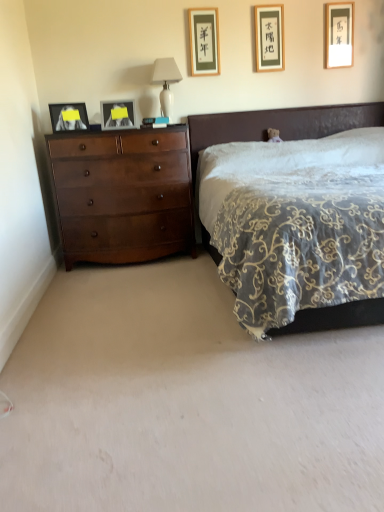
Locate an element on the screen. The width and height of the screenshot is (384, 512). matte wooden picture frame at upper center, placed as the fourth picture frame when sorted from left to right is located at coordinates (269, 38).

Image resolution: width=384 pixels, height=512 pixels. Describe the element at coordinates (68, 117) in the screenshot. I see `matte black picture frame at left, which appears as the 1th picture frame when viewed from the left` at that location.

What do you see at coordinates (279, 124) in the screenshot? The height and width of the screenshot is (512, 384). I see `velvet dark brown bed at center` at bounding box center [279, 124].

What are the coordinates of `black paper picture frame at upper center, the 3th picture frame viewed from the right` in the screenshot? It's located at (204, 41).

This screenshot has height=512, width=384. What do you see at coordinates (166, 83) in the screenshot?
I see `white glossy table lamp at upper center` at bounding box center [166, 83].

Where is `shiny brown dresser at left`? This screenshot has height=512, width=384. shiny brown dresser at left is located at coordinates (122, 195).

Between velvet dark brown bed at center and matte black picture frame at left, the 5th picture frame in the right-to-left sequence, which one appears on the right side from the viewer's perspective?

Positioned to the right is velvet dark brown bed at center.

In the scene shown: Considering the relative sizes of velvet dark brown bed at center and matte black picture frame at left, which appears as the 1th picture frame when viewed from the left, in the image provided, is velvet dark brown bed at center bigger than matte black picture frame at left, which appears as the 1th picture frame when viewed from the left,?

Correct, velvet dark brown bed at center is larger in size than matte black picture frame at left, which appears as the 1th picture frame when viewed from the left.

Is velvet dark brown bed at center wider than matte black picture frame at left, the 5th picture frame in the right-to-left sequence?

Indeed, velvet dark brown bed at center has a greater width compared to matte black picture frame at left, the 5th picture frame in the right-to-left sequence.

Locate an element on the screen. bed below the matte black picture frame at left, the 5th picture frame in the right-to-left sequence (from a real-world perspective) is located at coordinates (279, 124).

Does velvet dark brown bed at center turn towards white glossy table lamp at upper center?

No, velvet dark brown bed at center is not turned towards white glossy table lamp at upper center.

Between velvet dark brown bed at center and white glossy table lamp at upper center, which one has smaller width?

white glossy table lamp at upper center is thinner.

Is white glossy table lamp at upper center surrounded by velvet dark brown bed at center?

Definitely not — white glossy table lamp at upper center is not inside velvet dark brown bed at center.

Can you tell me how much matte wooden picture frame at upper center, placed as the 2th picture frame when sorted from right to left, and matte black picture frame at upper center, which is the second picture frame from left to right, differ in facing direction?

The angle between the facing direction of matte wooden picture frame at upper center, placed as the 2th picture frame when sorted from right to left, and the facing direction of matte black picture frame at upper center, which is the second picture frame from left to right, is 3.73 degrees.

Can you see matte wooden picture frame at upper center, placed as the 2th picture frame when sorted from right to left, touching matte black picture frame at upper center, the 4th picture frame in the right-to-left sequence?

No, matte wooden picture frame at upper center, placed as the 2th picture frame when sorted from right to left, is not making contact with matte black picture frame at upper center, the 4th picture frame in the right-to-left sequence.

How much distance is there between matte wooden picture frame at upper center, placed as the fourth picture frame when sorted from left to right, and matte black picture frame at upper center, the 4th picture frame in the right-to-left sequence?

matte wooden picture frame at upper center, placed as the fourth picture frame when sorted from left to right, and matte black picture frame at upper center, the 4th picture frame in the right-to-left sequence, are 1.35 meters apart from each other.

Can you confirm if matte wooden picture frame at upper center, placed as the 2th picture frame when sorted from right to left, is taller than matte black picture frame at upper center, which is the second picture frame from left to right?

Yes, matte wooden picture frame at upper center, placed as the 2th picture frame when sorted from right to left, is taller than matte black picture frame at upper center, which is the second picture frame from left to right.

Between matte gold picture frame at upper right, acting as the 5th picture frame starting from the left, and white glossy table lamp at upper center, which one has larger size?

white glossy table lamp at upper center is bigger.

You are a GUI agent. You are given a task and a screenshot of the screen. Output one action in this format:
    pyautogui.click(x=<x>, y=<y>)
    Task: Click on the 3rd picture frame to the right of the white glossy table lamp at upper center, starting your count from the anchor
    
    Given the screenshot: What is the action you would take?
    pos(339,34)

Can you tell me how much matte gold picture frame at upper right, acting as the 5th picture frame starting from the left, and white glossy table lamp at upper center differ in facing direction?

The angle between the facing direction of matte gold picture frame at upper right, acting as the 5th picture frame starting from the left, and the facing direction of white glossy table lamp at upper center is 3.81 degrees.

Is matte gold picture frame at upper right, acting as the 5th picture frame starting from the left, facing towards white glossy table lamp at upper center?

No, matte gold picture frame at upper right, acting as the 5th picture frame starting from the left, is not facing towards white glossy table lamp at upper center.

Is black paper picture frame at upper center, the third picture frame from the left, wider or thinner than shiny brown dresser at left?

Considering their sizes, black paper picture frame at upper center, the third picture frame from the left, looks slimmer than shiny brown dresser at left.

Is black paper picture frame at upper center, the 3th picture frame viewed from the right, next to shiny brown dresser at left and touching it?

No, black paper picture frame at upper center, the 3th picture frame viewed from the right, is not making contact with shiny brown dresser at left.

Can you confirm if black paper picture frame at upper center, the 3th picture frame viewed from the right, is positioned to the left of shiny brown dresser at left?

No.

Would you say black paper picture frame at upper center, the third picture frame from the left, contains shiny brown dresser at left?

Actually, shiny brown dresser at left is outside black paper picture frame at upper center, the third picture frame from the left.

Is matte gold picture frame at upper right, acting as the 5th picture frame starting from the left, smaller than matte black picture frame at left, which appears as the 1th picture frame when viewed from the left?

Correct, matte gold picture frame at upper right, acting as the 5th picture frame starting from the left, occupies less space than matte black picture frame at left, which appears as the 1th picture frame when viewed from the left.

Who is more distant, matte gold picture frame at upper right, acting as the 5th picture frame starting from the left, or matte black picture frame at left, which appears as the 1th picture frame when viewed from the left?

matte gold picture frame at upper right, acting as the 5th picture frame starting from the left, is further from the camera.

What's the angular difference between matte gold picture frame at upper right, acting as the 5th picture frame starting from the left, and matte black picture frame at left, the 5th picture frame in the right-to-left sequence,'s facing directions?

matte gold picture frame at upper right, acting as the 5th picture frame starting from the left, and matte black picture frame at left, the 5th picture frame in the right-to-left sequence, are facing 16 degrees away from each other.

Is matte black picture frame at left, which appears as the 1th picture frame when viewed from the left, shorter than velvet dark brown bed at center?

Correct, matte black picture frame at left, which appears as the 1th picture frame when viewed from the left, is not as tall as velvet dark brown bed at center.

Does point (50, 106) appear closer or farther from the camera than point (378, 318)?

Point (50, 106) is positioned farther from the camera compared to point (378, 318).

You are a GUI agent. You are given a task and a screenshot of the screen. Output one action in this format:
    pyautogui.click(x=<x>, y=<y>)
    Task: Click on the picture frame that is the 4th one when counting leftward from the velvet dark brown bed at center
    
    Given the screenshot: What is the action you would take?
    pyautogui.click(x=68, y=117)

The width and height of the screenshot is (384, 512). Identify the location of the 4th picture frame to the left of the velvet dark brown bed at center, counting from the anchor's position. (68, 117).

Image resolution: width=384 pixels, height=512 pixels. Find the location of `table lamp behind the velvet dark brown bed at center`. table lamp behind the velvet dark brown bed at center is located at coordinates (166, 83).

Estimate the real-world distances between objects in this image. Which object is closer to shiny brown dresser at left, matte black picture frame at left, the 5th picture frame in the right-to-left sequence, or matte wooden picture frame at upper center, placed as the fourth picture frame when sorted from left to right?

matte black picture frame at left, the 5th picture frame in the right-to-left sequence, is positioned closer to the anchor shiny brown dresser at left.

Looking at the image, which one is located closer to velvet dark brown bed at center, matte black picture frame at left, the 5th picture frame in the right-to-left sequence, or matte gold picture frame at upper right, acting as the 5th picture frame starting from the left?

Based on the image, matte gold picture frame at upper right, acting as the 5th picture frame starting from the left, appears to be nearer to velvet dark brown bed at center.

Which object lies nearer to the anchor point matte black picture frame at upper center, which is the second picture frame from left to right, white glossy table lamp at upper center or matte gold picture frame at upper right, acting as the 5th picture frame starting from the left?

white glossy table lamp at upper center is closer to matte black picture frame at upper center, which is the second picture frame from left to right.

Which object lies further to the anchor point matte black picture frame at upper center, the 4th picture frame in the right-to-left sequence, black paper picture frame at upper center, the third picture frame from the left, or matte black picture frame at left, the 5th picture frame in the right-to-left sequence?

black paper picture frame at upper center, the third picture frame from the left, is positioned further to the anchor matte black picture frame at upper center, the 4th picture frame in the right-to-left sequence.

Based on their spatial positions, is matte black picture frame at left, the 5th picture frame in the right-to-left sequence, or shiny brown dresser at left closer to matte black picture frame at upper center, which is the second picture frame from left to right?

The object closer to matte black picture frame at upper center, which is the second picture frame from left to right, is matte black picture frame at left, the 5th picture frame in the right-to-left sequence.

From the image, which object appears to be nearer to matte gold picture frame at upper right, acting as the 5th picture frame starting from the left, matte wooden picture frame at upper center, placed as the fourth picture frame when sorted from left to right, or matte black picture frame at upper center, which is the second picture frame from left to right?

matte wooden picture frame at upper center, placed as the fourth picture frame when sorted from left to right.

Which object lies nearer to the anchor point matte gold picture frame at upper right, acting as the 5th picture frame starting from the left, matte black picture frame at left, which appears as the 1th picture frame when viewed from the left, or velvet dark brown bed at center?

velvet dark brown bed at center is closer to matte gold picture frame at upper right, acting as the 5th picture frame starting from the left.

Based on their spatial positions, is matte gold picture frame at upper right, which ranks as the first picture frame in right-to-left order, or velvet dark brown bed at center closer to white glossy table lamp at upper center?

Among the two, velvet dark brown bed at center is located nearer to white glossy table lamp at upper center.

Find the location of `picture frame between matte black picture frame at left, the 5th picture frame in the right-to-left sequence, and black paper picture frame at upper center, the third picture frame from the left, from left to right`. picture frame between matte black picture frame at left, the 5th picture frame in the right-to-left sequence, and black paper picture frame at upper center, the third picture frame from the left, from left to right is located at coordinates (117, 114).

I want to click on table lamp between shiny brown dresser at left and matte gold picture frame at upper right, which ranks as the first picture frame in right-to-left order, from left to right, so coord(166,83).

Where is `table lamp between matte wooden picture frame at upper center, placed as the 2th picture frame when sorted from right to left, and shiny brown dresser at left in the up-down direction`? The image size is (384, 512). table lamp between matte wooden picture frame at upper center, placed as the 2th picture frame when sorted from right to left, and shiny brown dresser at left in the up-down direction is located at coordinates (166, 83).

At what (x,y) coordinates should I click in order to perform the action: click on the chest of drawers located between velvet dark brown bed at center and matte wooden picture frame at upper center, placed as the 2th picture frame when sorted from right to left, in the depth direction. Please return your answer as a coordinate pair (x, y). This screenshot has width=384, height=512. Looking at the image, I should click on (122, 195).